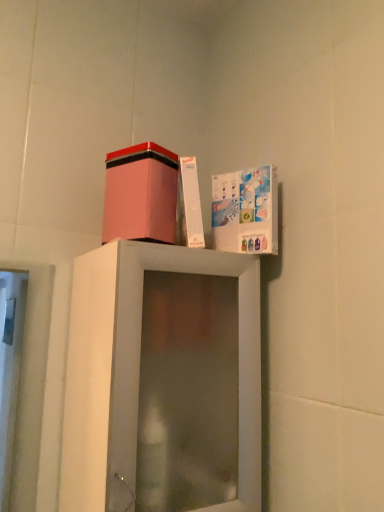
Question: Relative to white cardboard box at upper right, is pink matte cardboard box at upper center in front or behind?

Choices:
 (A) behind
 (B) front

Answer: (B)

Question: From a real-world perspective, is pink matte cardboard box at upper center above or below white cardboard box at upper right?

Choices:
 (A) below
 (B) above

Answer: (B)

Question: Is pink matte cardboard box at upper center taller or shorter than white cardboard box at upper right?

Choices:
 (A) short
 (B) tall

Answer: (A)

Question: Is white cardboard box at upper right taller or shorter than pink matte cardboard box at upper center?

Choices:
 (A) tall
 (B) short

Answer: (A)

Question: Considering the positions of point (271, 224) and point (173, 218), is point (271, 224) closer or farther from the camera than point (173, 218)?

Choices:
 (A) closer
 (B) farther

Answer: (B)

Question: Is white cardboard box at upper right inside the boundaries of pink matte cardboard box at upper center, or outside?

Choices:
 (A) outside
 (B) inside

Answer: (A)

Question: From a real-world perspective, is white cardboard box at upper right positioned above or below pink matte cardboard box at upper center?

Choices:
 (A) below
 (B) above

Answer: (A)